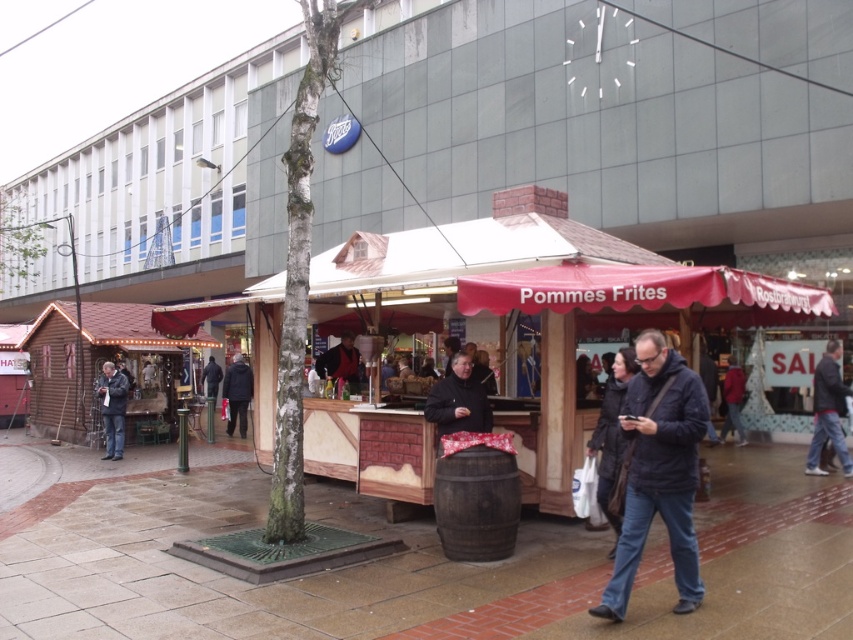
You are a photographer trying to capture the entire food stall and its surroundings. You notice the dark blue jacket at center and the pink fabric canopy at center in your frame. Which object should you adjust your camera angle to prioritize if you want to focus on the larger one?

The pink fabric canopy at center is larger than the dark blue jacket at center, so you should adjust your camera angle to prioritize the pink fabric canopy at center.